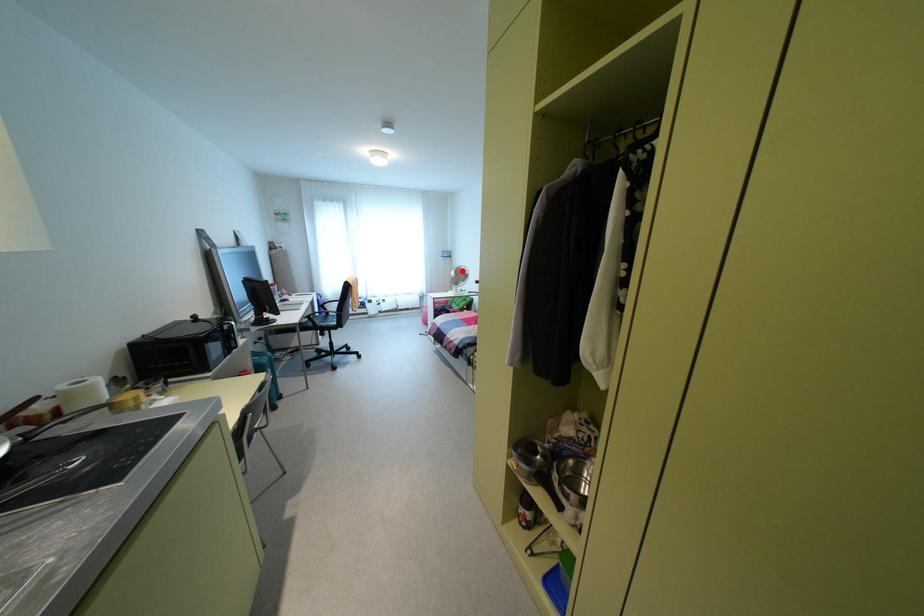
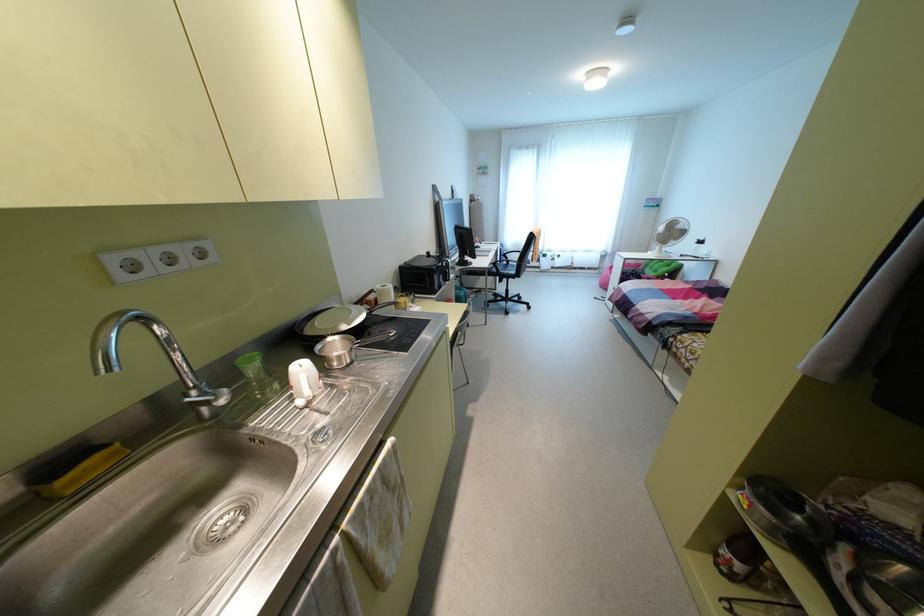
Find the pixel in the second image that matches the highlighted location in the first image.

(679, 225)